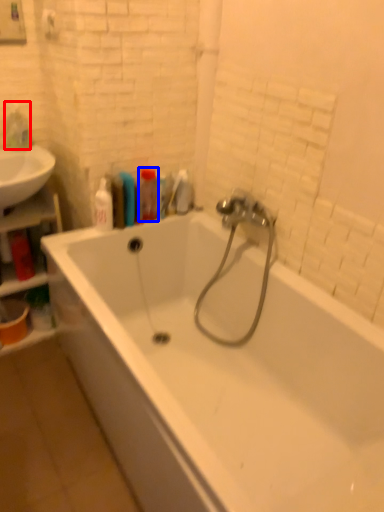
Question: Which of the following is the farthest to the observer, toiletry (highlighted by a red box) or toiletry (highlighted by a blue box)?

Choices:
 (A) toiletry
 (B) toiletry

Answer: (A)